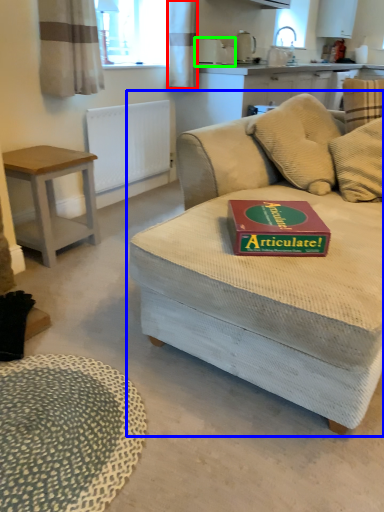
Question: Based on their relative distances, which object is nearer to curtain (highlighted by a red box)? Choose from studio couch (highlighted by a blue box) and appliance (highlighted by a green box).

Choices:
 (A) studio couch
 (B) appliance

Answer: (B)